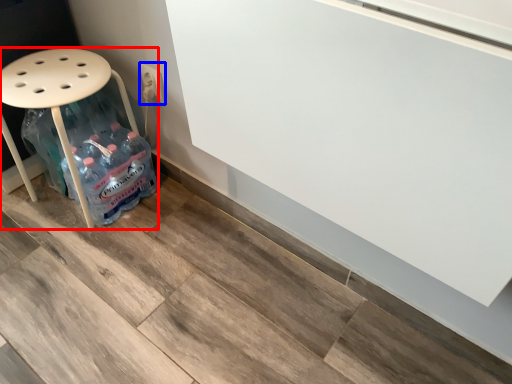
Question: Which object appears farthest to the camera in this image, furniture (highlighted by a red box) or electric outlet (highlighted by a blue box)?

Choices:
 (A) furniture
 (B) electric outlet

Answer: (B)